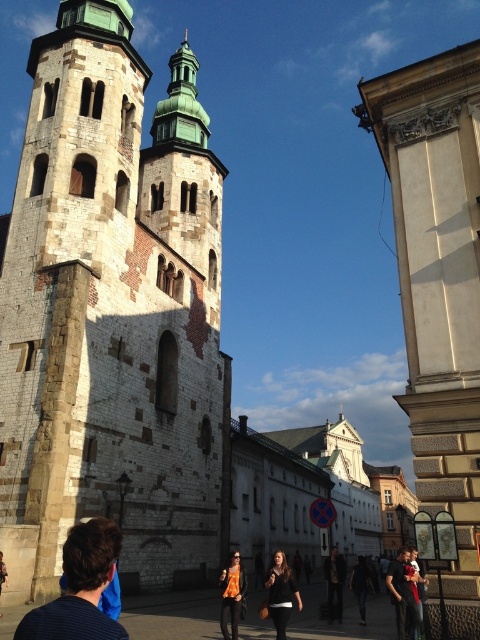
Question: Is white stone column at upper right below dark brown leather jacket at center?

Choices:
 (A) no
 (B) yes

Answer: (A)

Question: Does dark blue shirt at lower left appear under dark brown leather jacket at center?

Choices:
 (A) no
 (B) yes

Answer: (A)

Question: Which object appears closest to the camera in this image?

Choices:
 (A) dark brown leather jacket at center
 (B) dark brown leather jacket at lower center
 (C) dark blue shirt at center
 (D) jeans at center

Answer: (B)

Question: Is dark brown leather jacket at lower center wider than jeans at center?

Choices:
 (A) yes
 (B) no

Answer: (B)

Question: Which object appears closest to the camera in this image?

Choices:
 (A) orange fabric shirt at center
 (B) dark blue shirt at center
 (C) dark brown leather jacket at lower center
 (D) white stone tower at center

Answer: (C)

Question: Considering the real-world distances, which object is farthest from the jeans at center?

Choices:
 (A) orange fabric shirt at center
 (B) dark brown leather jacket at lower center
 (C) dark brown leather jacket at center
 (D) white stone tower at center

Answer: (D)